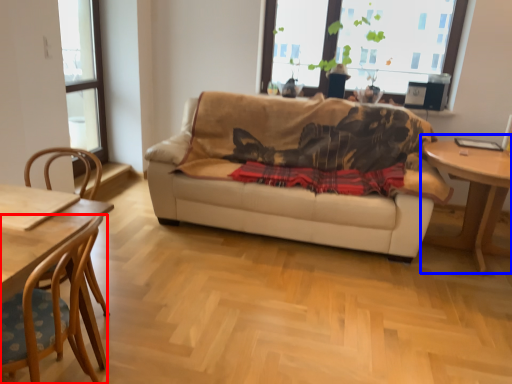
Question: Which object is closer to the camera taking this photo, chair (highlighted by a red box) or table (highlighted by a blue box)?

Choices:
 (A) chair
 (B) table

Answer: (A)